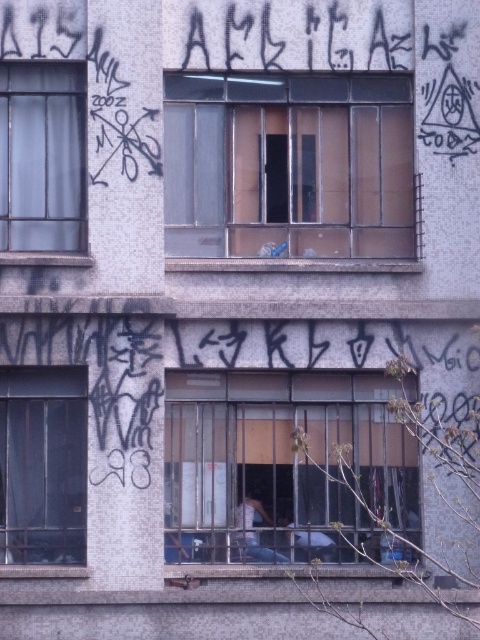
Question: Which of the following is the farthest from the observer?

Choices:
 (A) clear glass window at upper center
 (B) clear glass window at upper left
 (C) metallic bars at center
 (D) transparent glass window at left

Answer: (A)

Question: Is clear glass window at upper center to the right of clear glass window at upper left from the viewer's perspective?

Choices:
 (A) no
 (B) yes

Answer: (B)

Question: Can you confirm if transparent glass window at left is positioned to the left of clear glass window at upper left?

Choices:
 (A) no
 (B) yes

Answer: (A)

Question: Which of the following is the farthest from the observer?

Choices:
 (A) transparent glass window at left
 (B) clear glass window at upper center
 (C) clear glass window at upper left
 (D) metallic bars at center

Answer: (B)

Question: Which of the following is the farthest from the observer?

Choices:
 (A) (38, 513)
 (B) (74, 216)
 (C) (290, 422)
 (D) (274, 225)

Answer: (D)

Question: From the image, what is the correct spatial relationship of clear glass window at upper center in relation to clear glass window at upper left?

Choices:
 (A) above
 (B) below

Answer: (B)